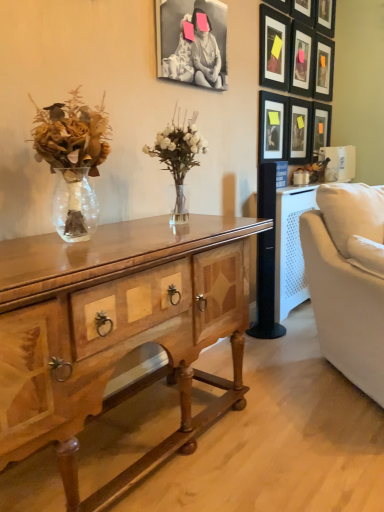
The height and width of the screenshot is (512, 384). I want to click on vacant space to the right of wooden desk at center, so click(x=288, y=431).